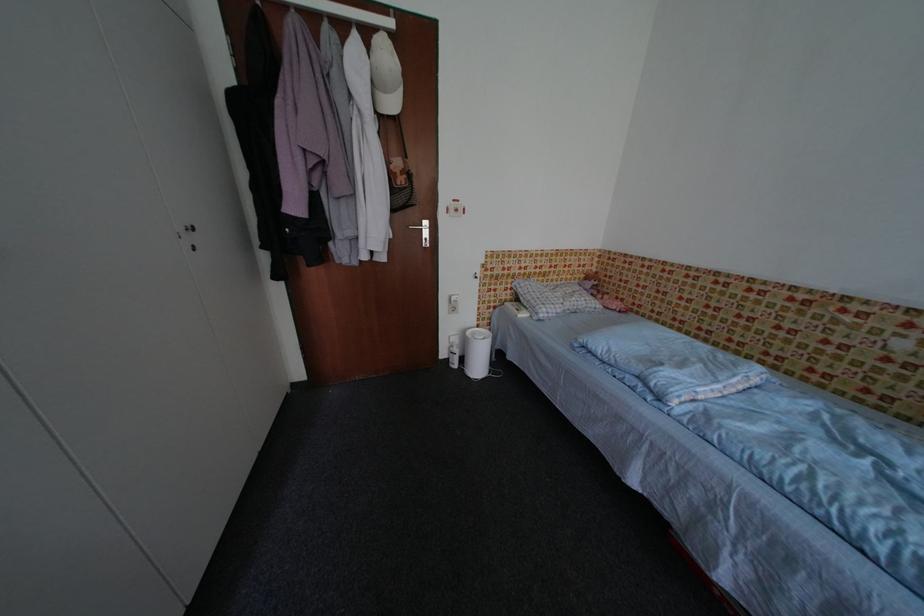
Locate an element on the screen. This screenshot has height=616, width=924. checkered pillow is located at coordinates (575, 297).